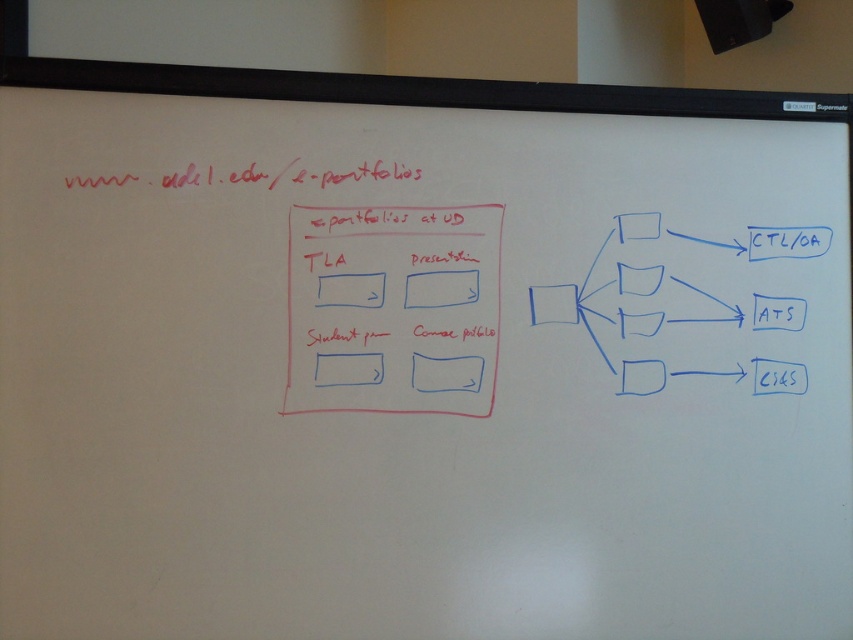
You are standing in front of the whiteboard and want to hand a white paper at center to a colleague who is standing 5 feet away from you. Can you reach them without moving?

The white paper at center is 4.73 feet from camera. Since your colleague is 5 feet away, you can just barely reach them by extending your arm to hand the white paper at center.

You are a student trying to place a 6 inch ruler between the white paper at center and the white matte square at center on the whiteboard. Will the ruler fit horizontally between them without overlapping either object?

The white paper at center and white matte square at center are 5.77 inches apart. Since the ruler is 6 inches long, it will not fit between them as the distance is shorter than the ruler.

You are standing in front of a whiteboard with a red box on the left and a blue diagram on the right. There is a point marked at coordinates (440, 289). What object is located at that specific point on the whiteboard?

The white matte presentation at center is located at point (440, 289).